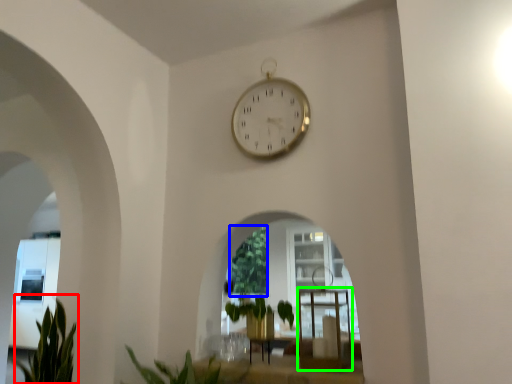
Question: Which is nearer to the plant (highlighted by a red box)? vegetation (highlighted by a blue box) or table (highlighted by a green box).

Choices:
 (A) vegetation
 (B) table

Answer: (A)